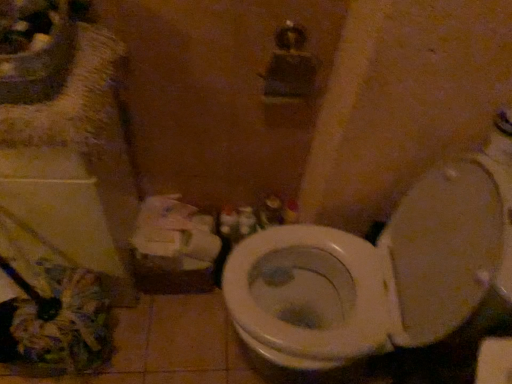
Question: From a real-world perspective, is white plastic container at center beneath white matte toilet paper at lower left?

Choices:
 (A) yes
 (B) no

Answer: (A)

Question: Is white plastic container at center smaller than white matte toilet paper at lower left?

Choices:
 (A) no
 (B) yes

Answer: (B)

Question: Is white plastic container at center not close to white matte toilet paper at lower left?

Choices:
 (A) yes
 (B) no

Answer: (B)

Question: Is white plastic container at center to the left of white matte toilet paper at lower left from the viewer's perspective?

Choices:
 (A) yes
 (B) no

Answer: (B)

Question: Does white plastic container at center have a lesser width compared to white matte toilet paper at lower left?

Choices:
 (A) yes
 (B) no

Answer: (A)

Question: From the image's perspective, does white plastic container at center appear higher than white matte toilet paper at lower left?

Choices:
 (A) yes
 (B) no

Answer: (A)

Question: Is white plastic container at center located outside matte white sink at upper left?

Choices:
 (A) yes
 (B) no

Answer: (A)

Question: From a real-world perspective, is white plastic container at center over matte white sink at upper left?

Choices:
 (A) yes
 (B) no

Answer: (B)

Question: Is white plastic container at center positioned with its back to matte white sink at upper left?

Choices:
 (A) yes
 (B) no

Answer: (B)

Question: Is white plastic container at center aimed at matte white sink at upper left?

Choices:
 (A) yes
 (B) no

Answer: (B)

Question: Is matte white sink at upper left a part of white plastic container at center?

Choices:
 (A) yes
 (B) no

Answer: (B)

Question: From the image's perspective, is white plastic container at center on top of matte white sink at upper left?

Choices:
 (A) no
 (B) yes

Answer: (A)

Question: Is matte white sink at upper left completely or partially outside of white plastic container at center?

Choices:
 (A) yes
 (B) no

Answer: (A)